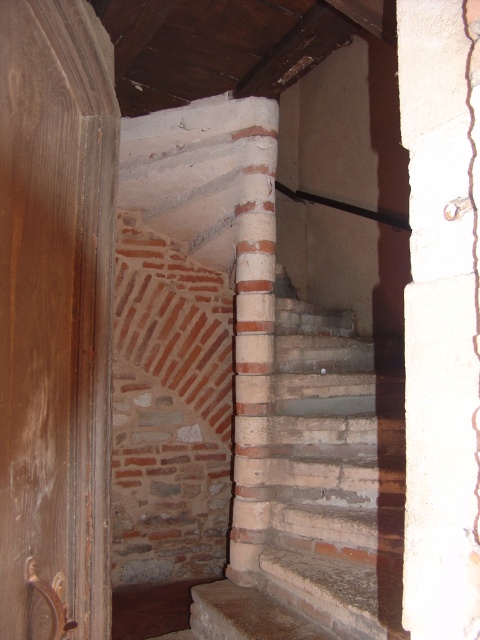
Is brown wood door at left smaller than stone textured stairs at center?

Yes, brown wood door at left is smaller than stone textured stairs at center.

Who is taller, brown wood door at left or stone textured stairs at center?

stone textured stairs at center

Is point (71, 38) closer to camera compared to point (236, 419)?

Yes, point (71, 38) is in front of point (236, 419).

You are a GUI agent. You are given a task and a screenshot of the screen. Output one action in this format:
    pyautogui.click(x=<x>, y=<y>)
    Task: Click on the brown wood door at left
    The width and height of the screenshot is (480, 640).
    Given the screenshot: What is the action you would take?
    pyautogui.click(x=56, y=316)

Between brown wood door at left and white concrete pillar at right, which one appears on the left side from the viewer's perspective?

brown wood door at left

Who is more forward, (104, 452) or (422, 17)?

Positioned in front is point (422, 17).

Between point (76, 109) and point (416, 440), which one is positioned in front?

Point (416, 440) is more forward.

Where is `brown wood door at left`? The image size is (480, 640). brown wood door at left is located at coordinates (56, 316).

Does stone textured stairs at center appear on the right side of white concrete pillar at right?

In fact, stone textured stairs at center is to the left of white concrete pillar at right.

Which is behind, point (364, 580) or point (458, 52)?

The point (364, 580) is more distant.

Locate an element on the screen. The image size is (480, 640). stone textured stairs at center is located at coordinates (312, 493).